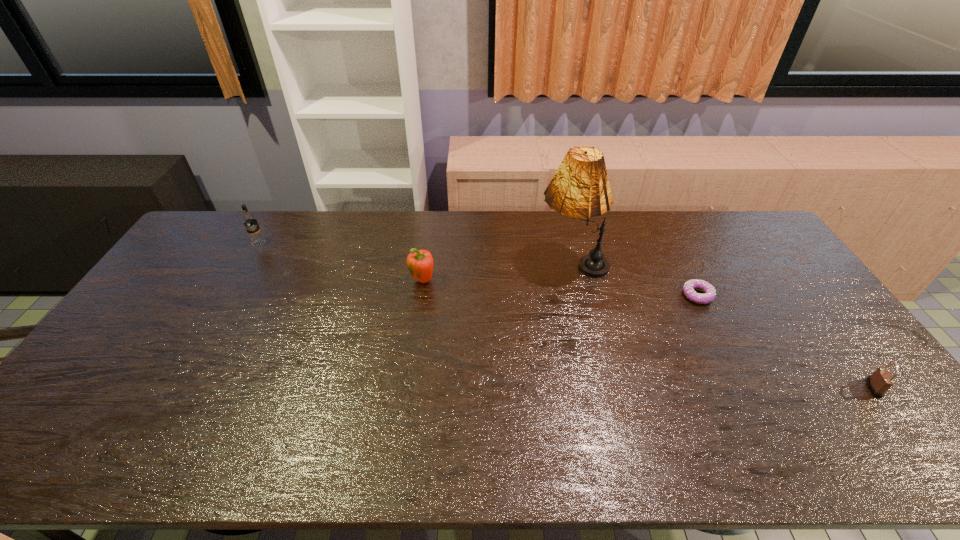
I want to click on vacant area at the near edge, so click(292, 461).

In the image, there is a desktop. In order to click on vacant region at the left edge in this screenshot , I will do `click(144, 310)`.

Where is `blank area at the right edge`? Image resolution: width=960 pixels, height=540 pixels. blank area at the right edge is located at coordinates (798, 299).

At what (x,y) coordinates should I click in order to perform the action: click on vacant region at the far left corner of the desktop. Please return your answer as a coordinate pair (x, y). Looking at the image, I should click on (232, 245).

Locate an element on the screen. free space at the far right corner is located at coordinates (726, 221).

Identify the location of unoccupied position between the vodka and the fourth object from right to left. (341, 262).

Find the location of `vacant space that is in between the second object from left to right and the third object from right to left`. vacant space that is in between the second object from left to right and the third object from right to left is located at coordinates (497, 272).

Identify the location of free space between the pepper and the vodka. (341, 262).

Where is `empty space that is in between the shortest object and the vodka`? Image resolution: width=960 pixels, height=540 pixels. empty space that is in between the shortest object and the vodka is located at coordinates (478, 269).

This screenshot has height=540, width=960. What are the coordinates of `vacant space that's between the leftmost object and the fourth object from right to left` in the screenshot? It's located at [341, 262].